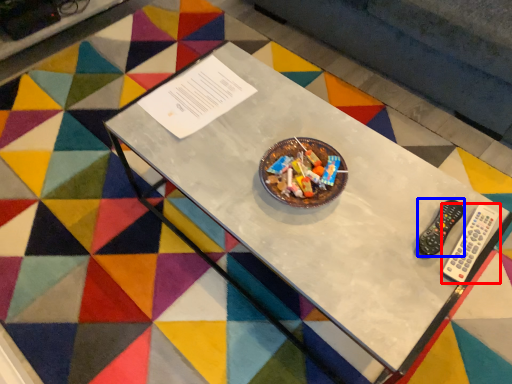
Question: Which point is closer to the camera, remote control (highlighted by a red box) or control (highlighted by a blue box)?

Choices:
 (A) remote control
 (B) control

Answer: (A)